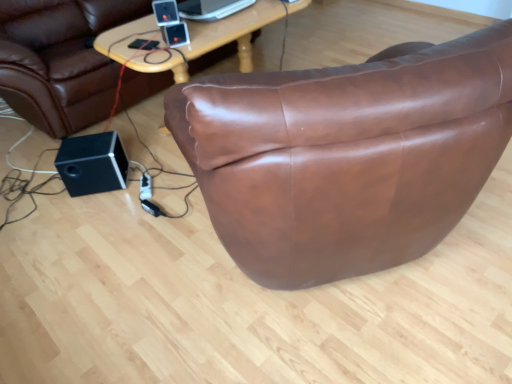
This screenshot has width=512, height=384. I want to click on black plastic speaker at upper center, the first speaker viewed from the front, so click(166, 12).

This screenshot has height=384, width=512. Identify the location of satin black ipod at upper center. (175, 34).

What do you see at coordinates (60, 60) in the screenshot?
I see `brown leather bean bag chair at center` at bounding box center [60, 60].

Locate an element on the screen. black plastic speaker at upper center, the 2th speaker positioned from the bottom is located at coordinates (166, 12).

Does point (160, 2) come behind point (181, 32)?

No, (160, 2) is closer to viewer.

Considering the relative sizes of black plastic speaker at upper center, which appears as the first speaker when viewed from the right, and satin black ipod at upper center in the image provided, is black plastic speaker at upper center, which appears as the first speaker when viewed from the right, wider than satin black ipod at upper center?

Correct, the width of black plastic speaker at upper center, which appears as the first speaker when viewed from the right, exceeds that of satin black ipod at upper center.

From a real-world perspective, is black plastic speaker at upper center, which appears as the first speaker when viewed from the right, above or below satin black ipod at upper center?

In terms of real-world spatial position, black plastic speaker at upper center, which appears as the first speaker when viewed from the right, is above satin black ipod at upper center.

Is brown leather bean bag chair at center to the right of black plastic speaker at upper center, the second speaker viewed from the left, from the viewer's perspective?

No, brown leather bean bag chair at center is not to the right of black plastic speaker at upper center, the second speaker viewed from the left.

Considering the sizes of objects brown leather bean bag chair at center and black plastic speaker at upper center, which is counted as the second speaker, starting from the back, in the image provided, who is wider, brown leather bean bag chair at center or black plastic speaker at upper center, which is counted as the second speaker, starting from the back,?

Wider between the two is brown leather bean bag chair at center.

Is brown leather bean bag chair at center next to black plastic speaker at upper center, the second speaker viewed from the left, and touching it?

brown leather bean bag chair at center and black plastic speaker at upper center, the second speaker viewed from the left, are not in contact.

Would you say black plastic speaker at upper center, which appears as the first speaker when viewed from the right, is part of brown leather bean bag chair at center's contents?

No, black plastic speaker at upper center, which appears as the first speaker when viewed from the right, is not surrounded by brown leather bean bag chair at center.

Considering the relative sizes of black plastic speaker at upper center, the 1th speaker when ordered from top to bottom, and brown leather bean bag chair at center in the image provided, is black plastic speaker at upper center, the 1th speaker when ordered from top to bottom, thinner than brown leather bean bag chair at center?

Indeed, black plastic speaker at upper center, the 1th speaker when ordered from top to bottom, has a lesser width compared to brown leather bean bag chair at center.

From the image's perspective, is black plastic speaker at upper center, the first speaker viewed from the front, over brown leather bean bag chair at center?

No, from the image's perspective, black plastic speaker at upper center, the first speaker viewed from the front, is not over brown leather bean bag chair at center.

What's the angular difference between black plastic speaker at upper center, the first speaker viewed from the front, and brown leather bean bag chair at center's facing directions?

black plastic speaker at upper center, the first speaker viewed from the front, and brown leather bean bag chair at center are facing 56.8 degrees away from each other.

Does black plastic speaker at upper center, the 2th speaker positioned from the bottom, appear on the right side of brown leather bean bag chair at center?

Correct, you'll find black plastic speaker at upper center, the 2th speaker positioned from the bottom, to the right of brown leather bean bag chair at center.

You are a GUI agent. You are given a task and a screenshot of the screen. Output one action in this format:
    pyautogui.click(x=<x>, y=<y>)
    Task: Click on the ipod in front of the black matte speaker at lower left, placed as the 1th speaker when sorted from left to right
    The width and height of the screenshot is (512, 384).
    Given the screenshot: What is the action you would take?
    pyautogui.click(x=175, y=34)

Can you tell me how much satin black ipod at upper center and black matte speaker at lower left, which is the 1th speaker from bottom to top, differ in facing direction?

There is a 20.1-degree angle between the facing directions of satin black ipod at upper center and black matte speaker at lower left, which is the 1th speaker from bottom to top.

Can you confirm if satin black ipod at upper center is positioned to the left of black matte speaker at lower left, which is the first speaker from back to front?

No, satin black ipod at upper center is not to the left of black matte speaker at lower left, which is the first speaker from back to front.

Is satin black ipod at upper center not close to black matte speaker at lower left, which is the first speaker from back to front?

No, there isn't a large distance between satin black ipod at upper center and black matte speaker at lower left, which is the first speaker from back to front.

Considering the relative sizes of brown leather bean bag chair at center and black matte speaker at lower left, which is the 1th speaker from bottom to top, in the image provided, is brown leather bean bag chair at center thinner than black matte speaker at lower left, which is the 1th speaker from bottom to top,?

No.

The image size is (512, 384). I want to click on bean bag chair located above the black matte speaker at lower left, which is the 2th speaker in top-to-bottom order (from a real-world perspective), so click(x=60, y=60).

Is brown leather bean bag chair at center in contact with black matte speaker at lower left, which is the first speaker from back to front?

No, brown leather bean bag chair at center is not beside black matte speaker at lower left, which is the first speaker from back to front.

Could you tell me if brown leather bean bag chair at center is facing black matte speaker at lower left, which is the first speaker from back to front?

Yes, brown leather bean bag chair at center is oriented towards black matte speaker at lower left, which is the first speaker from back to front.

Considering the relative positions of black matte speaker at lower left, which is the second speaker in front-to-back order, and satin black ipod at upper center in the image provided, is black matte speaker at lower left, which is the second speaker in front-to-back order, in front of satin black ipod at upper center?

No, black matte speaker at lower left, which is the second speaker in front-to-back order, is further to the viewer.

Is black matte speaker at lower left, which is the 2th speaker in top-to-bottom order, wider than satin black ipod at upper center?

Indeed, black matte speaker at lower left, which is the 2th speaker in top-to-bottom order, has a greater width compared to satin black ipod at upper center.

Considering the sizes of black matte speaker at lower left, which is the first speaker from back to front, and satin black ipod at upper center in the image, is black matte speaker at lower left, which is the first speaker from back to front, taller or shorter than satin black ipod at upper center?

black matte speaker at lower left, which is the first speaker from back to front, is taller than satin black ipod at upper center.

From a real-world perspective, is black matte speaker at lower left, placed as the 1th speaker when sorted from left to right, on top of black plastic speaker at upper center, which appears as the first speaker when viewed from the right?

No, from a real-world perspective, black matte speaker at lower left, placed as the 1th speaker when sorted from left to right, is not over black plastic speaker at upper center, which appears as the first speaker when viewed from the right

From the image's perspective, which one is positioned higher, black matte speaker at lower left, which is the second speaker in front-to-back order, or black plastic speaker at upper center, the 2th speaker positioned from the bottom?

From the image's view, black plastic speaker at upper center, the 2th speaker positioned from the bottom, is above.

Is point (87, 177) closer or farther from the camera than point (155, 4)?

Clearly, point (87, 177) is more distant from the camera than point (155, 4).

Image resolution: width=512 pixels, height=384 pixels. Find the location of `speaker located in front of the satin black ipod at upper center`. speaker located in front of the satin black ipod at upper center is located at coordinates (166, 12).

You are a GUI agent. You are given a task and a screenshot of the screen. Output one action in this format:
    pyautogui.click(x=<x>, y=<y>)
    Task: Click on the bean bag chair above the black plastic speaker at upper center, the 1th speaker when ordered from top to bottom (from the image's perspective)
    
    Given the screenshot: What is the action you would take?
    pyautogui.click(x=60, y=60)

Which object lies nearer to the anchor point brown leather bean bag chair at center, satin black ipod at upper center or black matte speaker at lower left, placed as the 1th speaker when sorted from left to right?

black matte speaker at lower left, placed as the 1th speaker when sorted from left to right.

When comparing their distances from black matte speaker at lower left, which is the second speaker in right-to-left order, does brown leather bean bag chair at center or black plastic speaker at upper center, the first speaker viewed from the front, seem closer?

brown leather bean bag chair at center.

Considering their positions, is black plastic speaker at upper center, the 2th speaker positioned from the bottom, positioned further to black matte speaker at lower left, which is the first speaker from back to front, than satin black ipod at upper center?

Based on the image, black plastic speaker at upper center, the 2th speaker positioned from the bottom, appears to be further to black matte speaker at lower left, which is the first speaker from back to front.

Considering their positions, is brown leather bean bag chair at center positioned further to black plastic speaker at upper center, which is counted as the second speaker, starting from the back, than black matte speaker at lower left, which is the 2th speaker in top-to-bottom order?

Based on the image, brown leather bean bag chair at center appears to be further to black plastic speaker at upper center, which is counted as the second speaker, starting from the back.

Consider the image. Based on their spatial positions, is satin black ipod at upper center or black matte speaker at lower left, which is the second speaker in right-to-left order, closer to black plastic speaker at upper center, the 2th speaker positioned from the bottom?

Among the two, satin black ipod at upper center is located nearer to black plastic speaker at upper center, the 2th speaker positioned from the bottom.

Which object lies nearer to the anchor point brown leather bean bag chair at center, satin black ipod at upper center or black plastic speaker at upper center, which appears as the first speaker when viewed from the right?

black plastic speaker at upper center, which appears as the first speaker when viewed from the right, lies closer to brown leather bean bag chair at center than the other object.

Based on the photo, when comparing their distances from black plastic speaker at upper center, the 2th speaker positioned from the bottom, does black matte speaker at lower left, which is the second speaker in right-to-left order, or satin black ipod at upper center seem closer?

Based on the image, satin black ipod at upper center appears to be nearer to black plastic speaker at upper center, the 2th speaker positioned from the bottom.

From the image, which object appears to be farther from satin black ipod at upper center, brown leather bean bag chair at center or black matte speaker at lower left, which is the 1th speaker from bottom to top?

Based on the image, brown leather bean bag chair at center appears to be further to satin black ipod at upper center.

In order to click on speaker that lies between brown leather bean bag chair at center and black matte speaker at lower left, which is the second speaker in right-to-left order, from top to bottom in this screenshot , I will do `click(166, 12)`.

The width and height of the screenshot is (512, 384). What are the coordinates of `ipod between black plastic speaker at upper center, the 2th speaker positioned from the bottom, and black matte speaker at lower left, which is the second speaker in front-to-back order, in the vertical direction` in the screenshot? It's located at (175, 34).

The height and width of the screenshot is (384, 512). In order to click on ipod between brown leather bean bag chair at center and black matte speaker at lower left, which is the second speaker in front-to-back order, vertically in this screenshot , I will do `click(175, 34)`.